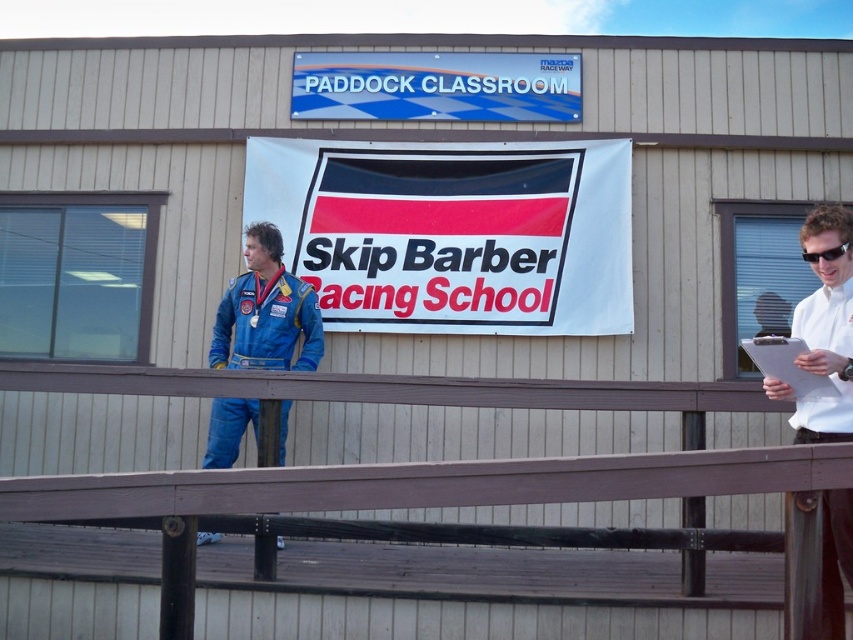
Can you confirm if white fabric banner at center is shorter than black plastic goggles at upper right?

In fact, white fabric banner at center may be taller than black plastic goggles at upper right.

Who is positioned more to the left, white fabric banner at center or black plastic goggles at upper right?

Positioned to the left is white fabric banner at center.

Is point (630, 275) positioned in front of point (824, 260)?

No, it is not.

The height and width of the screenshot is (640, 853). Find the location of `white fabric banner at center`. white fabric banner at center is located at coordinates (451, 232).

Does white paper clipboard at right appear over black plastic goggles at upper right?

No.

Which is more to the right, white paper clipboard at right or black plastic goggles at upper right?

From the viewer's perspective, black plastic goggles at upper right appears more on the right side.

Locate an element on the screen. This screenshot has width=853, height=640. white paper clipboard at right is located at coordinates (788, 365).

Which is more to the left, white fabric banner at center or white paper clipboard at right?

Positioned to the left is white fabric banner at center.

Between point (555, 317) and point (817, 396), which one is positioned in front?

Positioned in front is point (817, 396).

What do you see at coordinates (451, 232) in the screenshot? I see `white fabric banner at center` at bounding box center [451, 232].

You are a GUI agent. You are given a task and a screenshot of the screen. Output one action in this format:
    pyautogui.click(x=<x>, y=<y>)
    Task: Click on the white fabric banner at center
    This screenshot has height=640, width=853.
    Given the screenshot: What is the action you would take?
    451,232